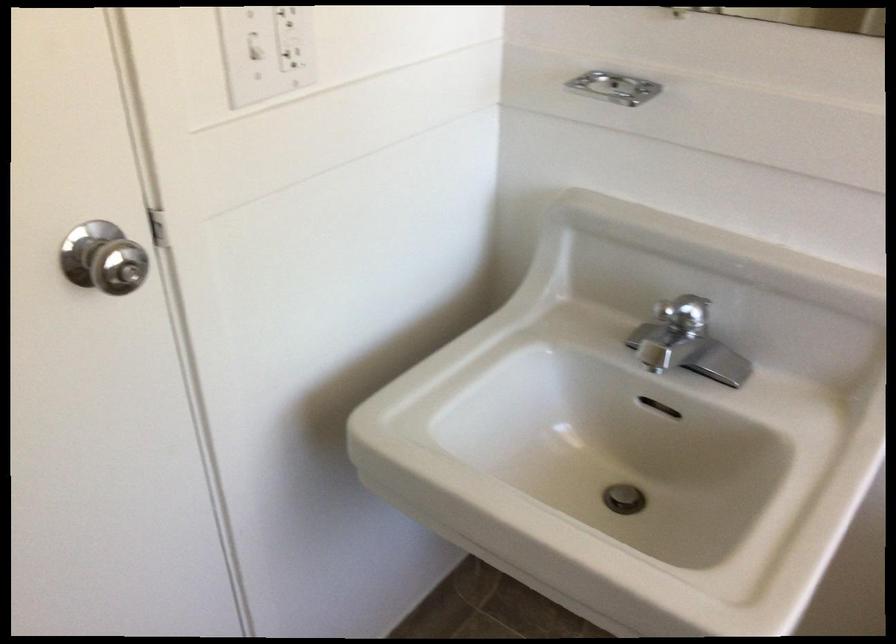
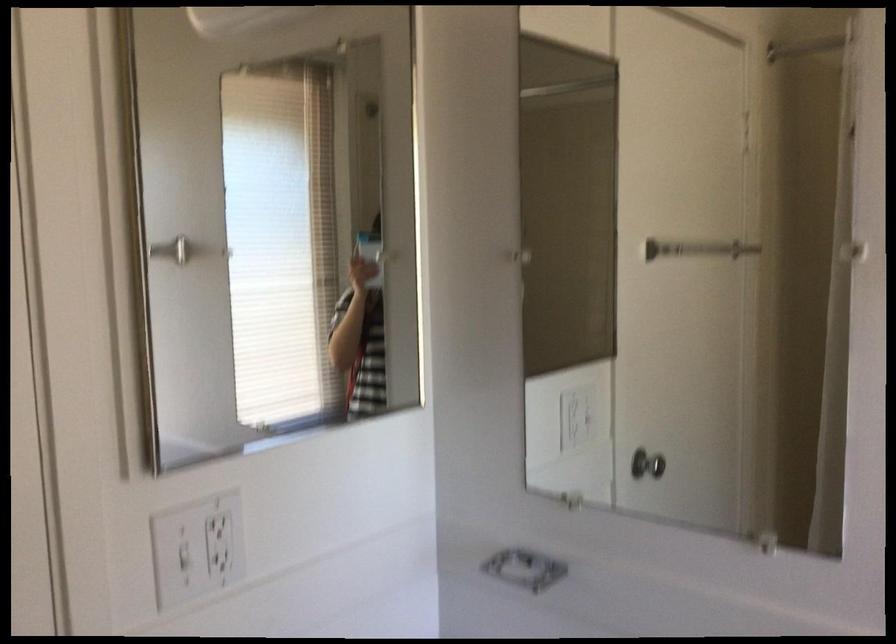
Question: The images are taken continuously from a first-person perspective. In which direction is your viewpoint rotating?

Choices:
 (A) Left
 (B) Right
 (C) Up
 (D) Down

Answer: (C)